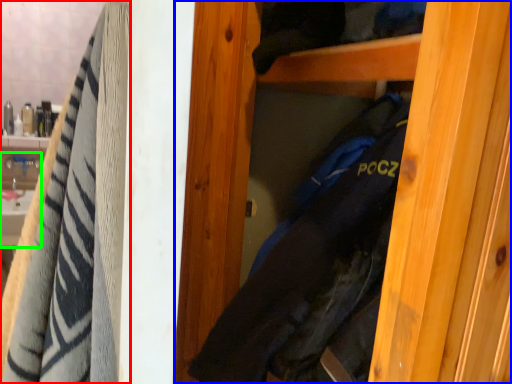
Question: Estimate the real-world distances between objects in this image. Which object is farther from towel (highlighted by a red box), door (highlighted by a blue box) or sink (highlighted by a green box)?

Choices:
 (A) door
 (B) sink

Answer: (B)